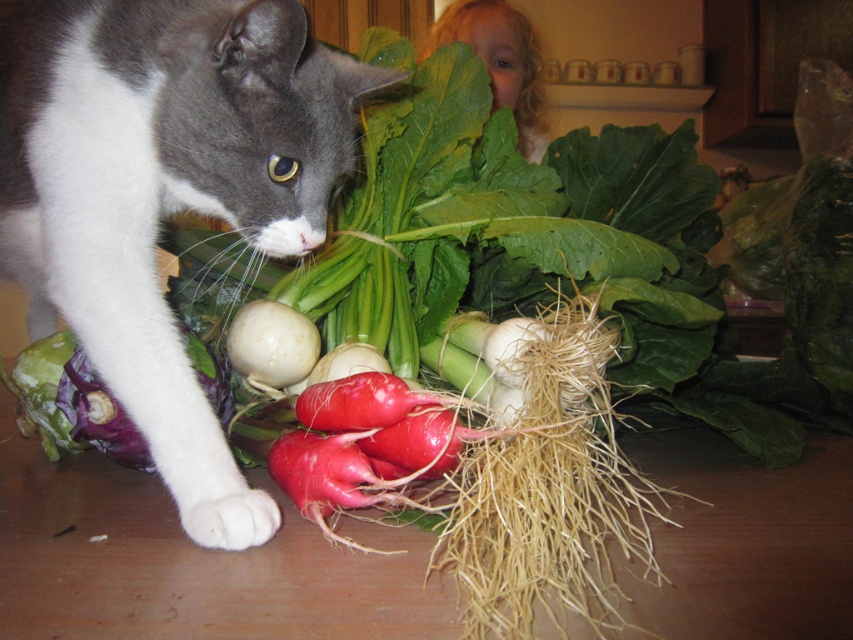
Question: Is gray fur cat at left to the right of white matte onion at center from the viewer's perspective?

Choices:
 (A) yes
 (B) no

Answer: (B)

Question: Which of the following is the farthest from the observer?

Choices:
 (A) (585, 321)
 (B) (241, 4)

Answer: (B)

Question: Estimate the real-world distances between objects in this image. Which object is closer to the dry straw roots at center?

Choices:
 (A) gray fur cat at left
 (B) white matte onion at center

Answer: (A)

Question: Does dry straw roots at center appear on the right side of white matte onion at center?

Choices:
 (A) no
 (B) yes

Answer: (B)

Question: Which object is farther from the camera taking this photo?

Choices:
 (A) gray fur cat at left
 (B) dry straw roots at center

Answer: (A)

Question: From the image, what is the correct spatial relationship of gray fur cat at left in relation to dry straw roots at center?

Choices:
 (A) above
 (B) below

Answer: (A)